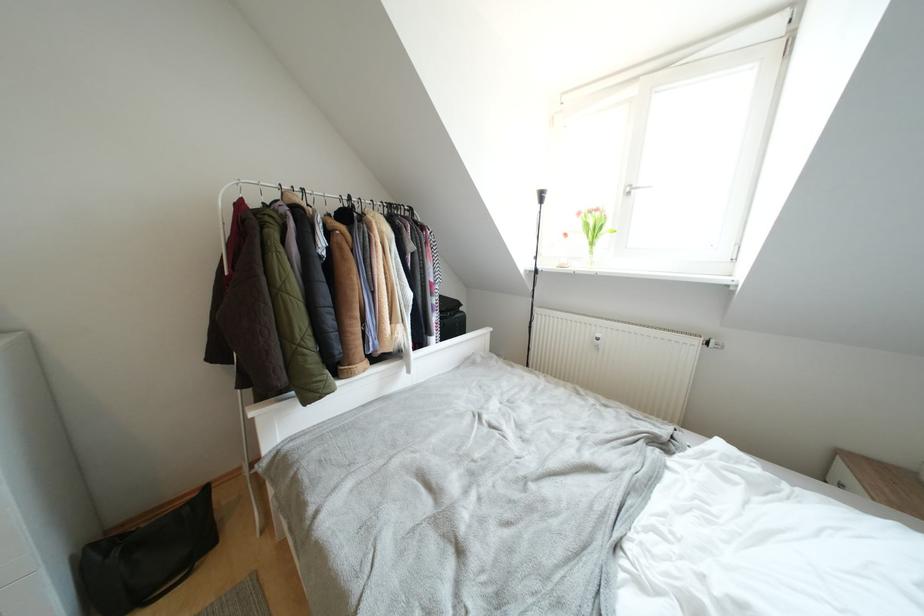
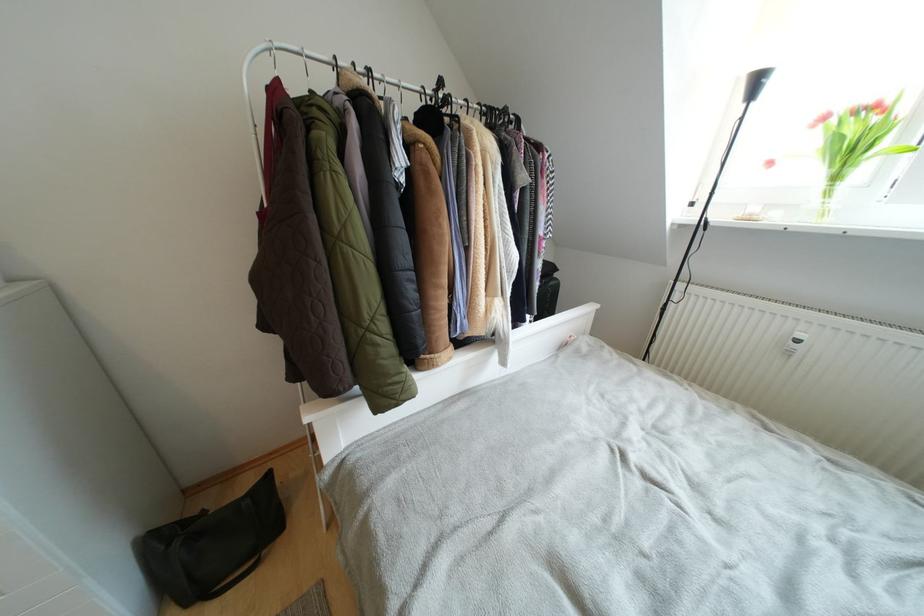
The point at (603, 339) is marked in the first image. Where is the corresponding point in the second image?

(805, 339)